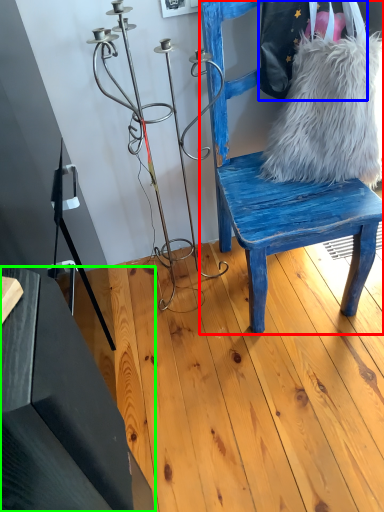
Question: Considering the real-world distances, which object is farthest from chair (highlighted by a red box)? shoulder bag (highlighted by a blue box) or table (highlighted by a green box)?

Choices:
 (A) shoulder bag
 (B) table

Answer: (B)